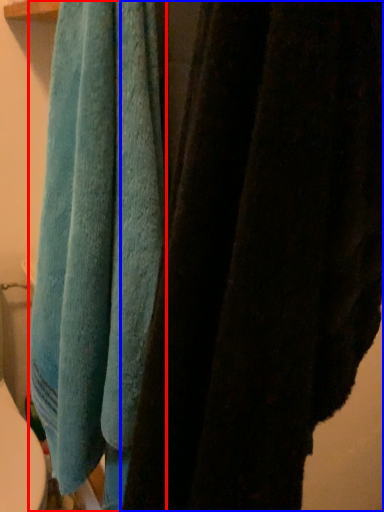
Question: Which of the following is the closest to the observer, towel (highlighted by a red box) or towel (highlighted by a blue box)?

Choices:
 (A) towel
 (B) towel

Answer: (B)